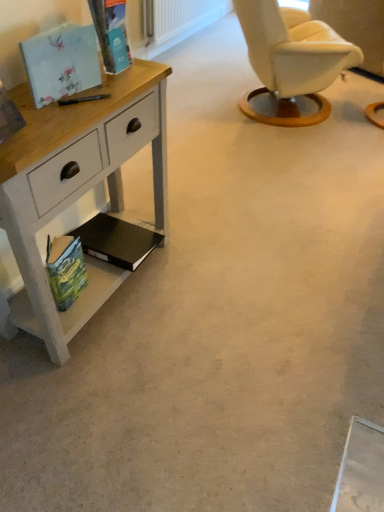
The height and width of the screenshot is (512, 384). Find the location of `free location to the right of matte floral-patterned book at upper left, which appears as the 3th magazine when ordered from the bottom`. free location to the right of matte floral-patterned book at upper left, which appears as the 3th magazine when ordered from the bottom is located at coordinates 105,98.